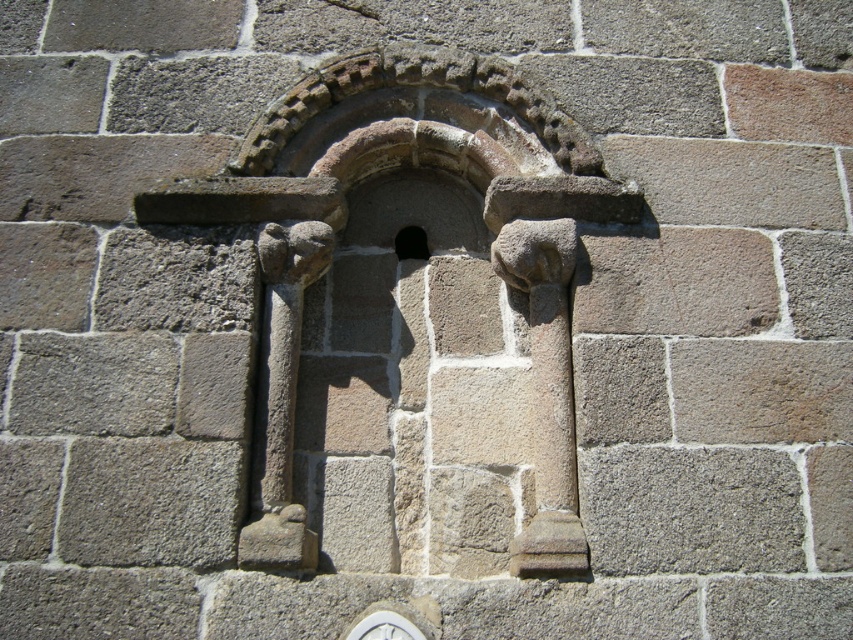
Question: Is rustic stone arch at center wider than black stone window at center?

Choices:
 (A) no
 (B) yes

Answer: (A)

Question: Is rustic stone arch at center wider than black stone window at center?

Choices:
 (A) yes
 (B) no

Answer: (B)

Question: Among these points, which one is farthest from the camera?

Choices:
 (A) (287, 492)
 (B) (421, 248)

Answer: (B)

Question: Is rustic stone arch at center wider than black stone window at center?

Choices:
 (A) yes
 (B) no

Answer: (B)